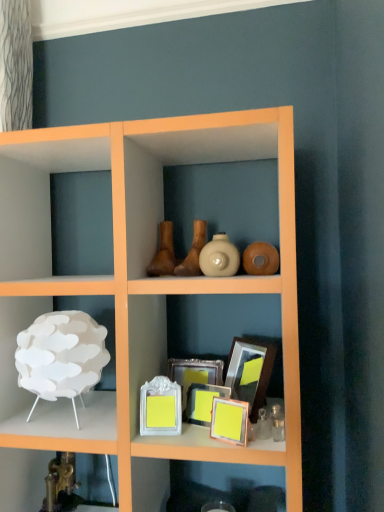
Question: Could you tell me if metallic gold faucet at lower left, acting as the first shelf starting from the bottom, is turned towards white glossy vase at center, which is counted as the first vase, starting from the right?

Choices:
 (A) yes
 (B) no

Answer: (B)

Question: Is metallic gold faucet at lower left, acting as the first shelf starting from the bottom, further to camera compared to white glossy vase at center, which is counted as the first vase, starting from the right?

Choices:
 (A) yes
 (B) no

Answer: (A)

Question: Is the position of metallic gold faucet at lower left, which is counted as the 2th shelf, starting from the top, less distant than that of white glossy vase at center, placed as the third vase when sorted from left to right?

Choices:
 (A) yes
 (B) no

Answer: (B)

Question: Can you confirm if metallic gold faucet at lower left, which is counted as the 2th shelf, starting from the top, is thinner than white glossy vase at center, which is counted as the first vase, starting from the right?

Choices:
 (A) yes
 (B) no

Answer: (B)

Question: Can you confirm if metallic gold faucet at lower left, acting as the first shelf starting from the bottom, is taller than white glossy vase at center, which is counted as the first vase, starting from the right?

Choices:
 (A) yes
 (B) no

Answer: (A)

Question: From the image's perspective, is metallic gold faucet at lower left, acting as the first shelf starting from the bottom, located beneath white glossy vase at center, which is counted as the first vase, starting from the right?

Choices:
 (A) no
 (B) yes

Answer: (B)

Question: Does brown matte vase at center, arranged as the 2th vase when viewed from the right, touch matte yellow picture frame at center, arranged as the 4th picture frame when viewed from the back?

Choices:
 (A) yes
 (B) no

Answer: (B)

Question: Does brown matte vase at center, the second vase when ordered from left to right, turn towards matte yellow picture frame at center, which appears as the 1th picture frame when viewed from the front?

Choices:
 (A) no
 (B) yes

Answer: (A)

Question: Is brown matte vase at center, the second vase when ordered from left to right, facing away from matte yellow picture frame at center, which appears as the 1th picture frame when viewed from the front?

Choices:
 (A) no
 (B) yes

Answer: (A)

Question: Considering the relative positions of brown matte vase at center, the second vase when ordered from left to right, and matte yellow picture frame at center, arranged as the 4th picture frame when viewed from the back, in the image provided, is brown matte vase at center, the second vase when ordered from left to right, behind matte yellow picture frame at center, arranged as the 4th picture frame when viewed from the back,?

Choices:
 (A) no
 (B) yes

Answer: (B)

Question: Considering the relative sizes of brown matte vase at center, the second vase when ordered from left to right, and matte yellow picture frame at center, which appears as the 1th picture frame when viewed from the front, in the image provided, is brown matte vase at center, the second vase when ordered from left to right, taller than matte yellow picture frame at center, which appears as the 1th picture frame when viewed from the front,?

Choices:
 (A) no
 (B) yes

Answer: (B)

Question: Does brown matte vase at center, arranged as the 2th vase when viewed from the right, have a greater width compared to matte yellow picture frame at center, which appears as the 1th picture frame when viewed from the front?

Choices:
 (A) yes
 (B) no

Answer: (A)

Question: Is matte brown vase at center, the third vase in the right-to-left sequence, facing towards white matte lamp at left, which ranks as the second shelf in bottom-to-top order?

Choices:
 (A) yes
 (B) no

Answer: (B)